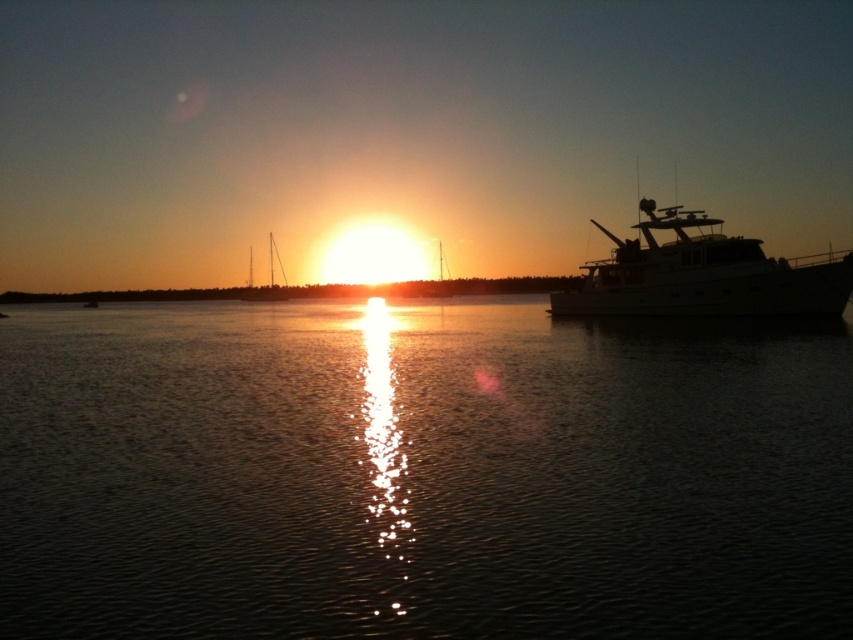
You are an observer standing on the shore looking at the sunset scene. Which object, the glistening water at center or the white glossy boat at right, occupies a bigger area in the image?

The glistening water at center occupies a bigger area in the image as it is larger in size than the white glossy boat at right.

You are an observer standing on the shore looking at the sunset scene. You notice the glistening water at center and the white glossy boat at right. Which object is positioned lower in the scene?

The glistening water at center is located below the white glossy boat at right, so it is positioned lower in the scene.